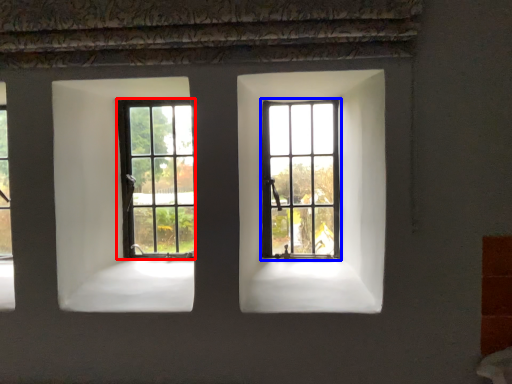
Question: Which object appears farthest to the camera in this image, window (highlighted by a red box) or window (highlighted by a blue box)?

Choices:
 (A) window
 (B) window

Answer: (A)